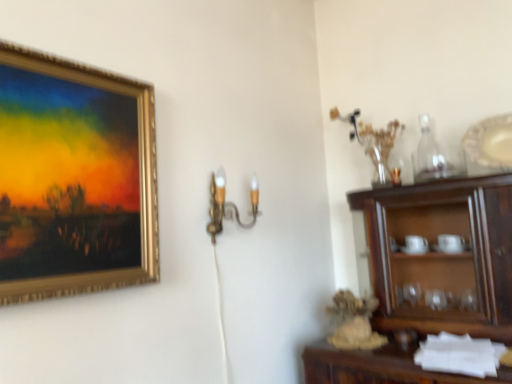
Identify the location of vacant region above gold metallic picture frame at upper left (from a real-world perspective). (76, 63).